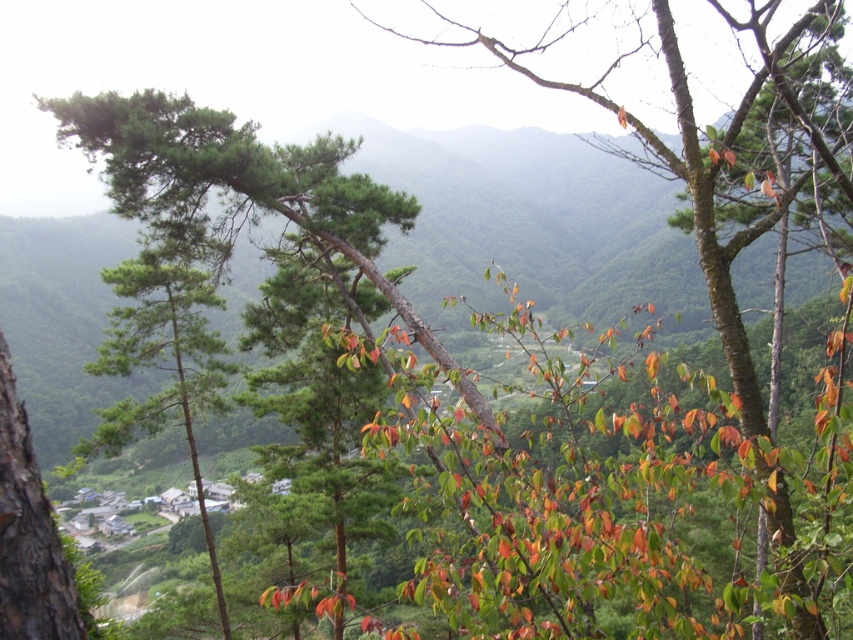
You are an aerial photographer planning to capture the entire scene. You notice two trees labeled as green matte tree at upper center and green matte tree at left. Which tree is positioned higher up in the image?

The green matte tree at upper center is positioned higher up in the image than the green matte tree at left.

You are a hiker who has just reached a viewpoint overlooking the valley. You notice a green matte tree at upper center in your field of view. If you were to mark its location on a coordinate grid where the bottom left corner is 0,0 and the top right corner is 1,1, what are its coordinates?

The green matte tree at upper center is located at coordinates point [664,400].